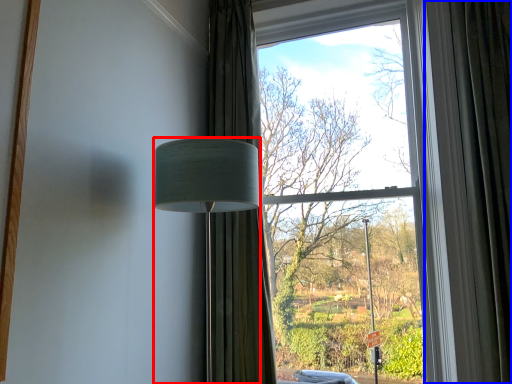
Question: Which object appears closest to the camera in this image, lamp (highlighted by a red box) or curtain (highlighted by a blue box)?

Choices:
 (A) lamp
 (B) curtain

Answer: (A)